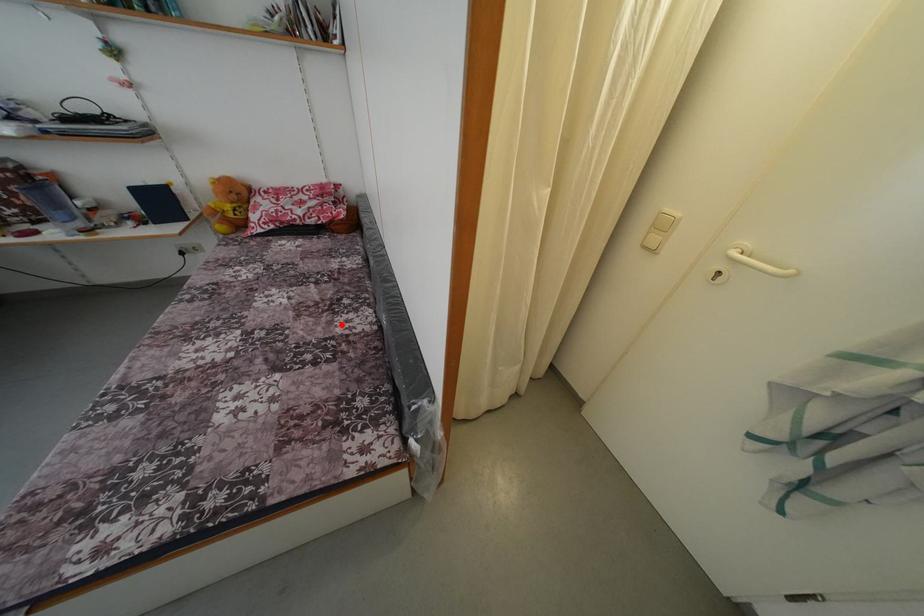
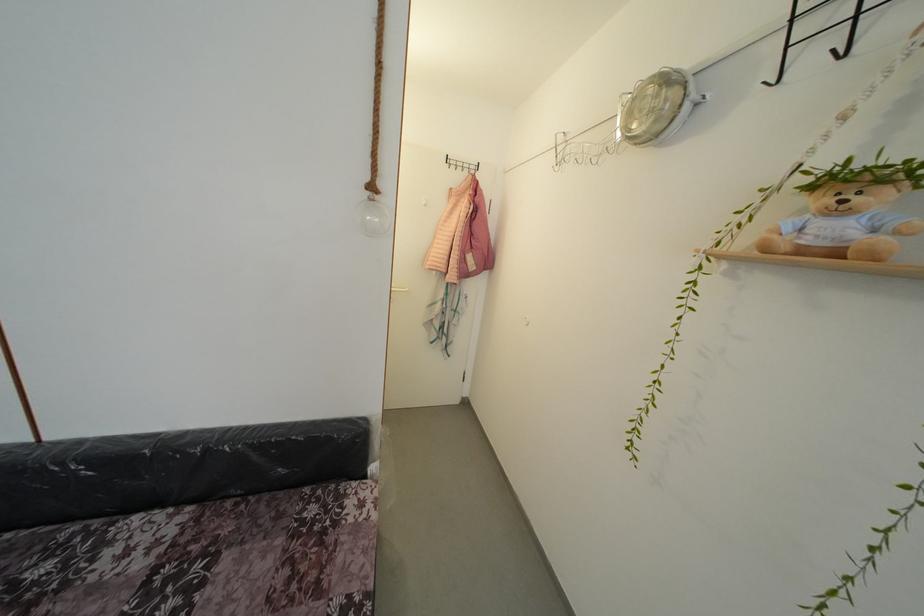
In the second image, find the point that corresponds to the highlighted location in the first image.

(99, 585)